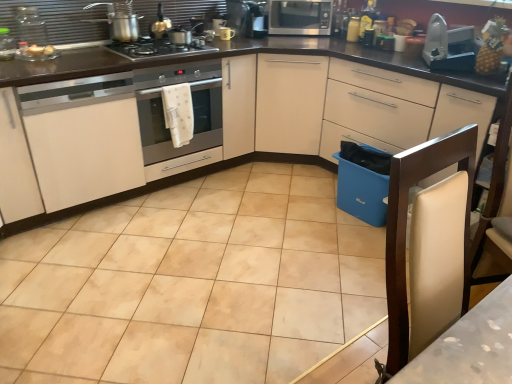
Identify the location of empty space that is ontop of satin silver oven at center (from a real-world perspective). (162, 51).